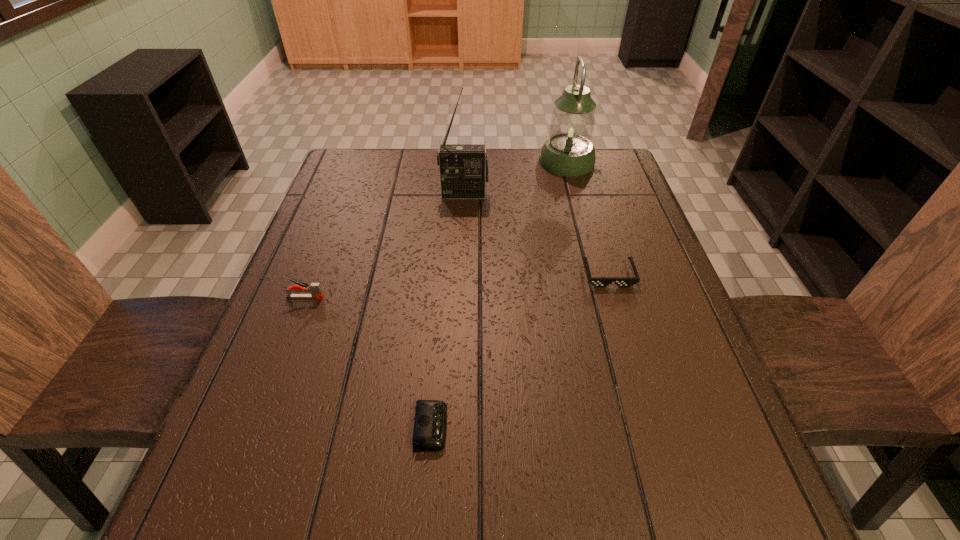
Identify the location of vacant space situated on the display of the alarm clock. pyautogui.click(x=613, y=427).

Identify the location of lantern present at the far edge. The image size is (960, 540). (568, 151).

Where is `radio receiver present at the far edge`? Image resolution: width=960 pixels, height=540 pixels. radio receiver present at the far edge is located at coordinates (463, 167).

You are a GUI agent. You are given a task and a screenshot of the screen. Output one action in this format:
    pyautogui.click(x=<x>, y=<y>)
    Task: Click on the object present at the left edge
    This screenshot has width=960, height=540.
    Given the screenshot: What is the action you would take?
    pyautogui.click(x=315, y=289)

At what (x,y) coordinates should I click in order to perform the action: click on lantern that is positioned at the right edge. Please return your answer as a coordinate pair (x, y). The width and height of the screenshot is (960, 540). Looking at the image, I should click on coord(568,151).

This screenshot has width=960, height=540. I want to click on sunglasses positioned at the right edge, so click(x=599, y=282).

You are a GUI agent. You are given a task and a screenshot of the screen. Output one action in this format:
    pyautogui.click(x=<x>, y=<y>)
    Task: Click on the object situated at the far right corner
    Image resolution: width=960 pixels, height=540 pixels.
    Given the screenshot: What is the action you would take?
    pyautogui.click(x=568, y=151)

I want to click on vacant space at the far edge, so [422, 172].

The width and height of the screenshot is (960, 540). In the image, there is a desktop. What are the coordinates of `vacant space at the near edge` in the screenshot? It's located at (414, 526).

You are a GUI agent. You are given a task and a screenshot of the screen. Output one action in this format:
    pyautogui.click(x=<x>, y=<y>)
    Task: Click on the vacant space at the left edge of the desktop
    
    Given the screenshot: What is the action you would take?
    pyautogui.click(x=348, y=232)